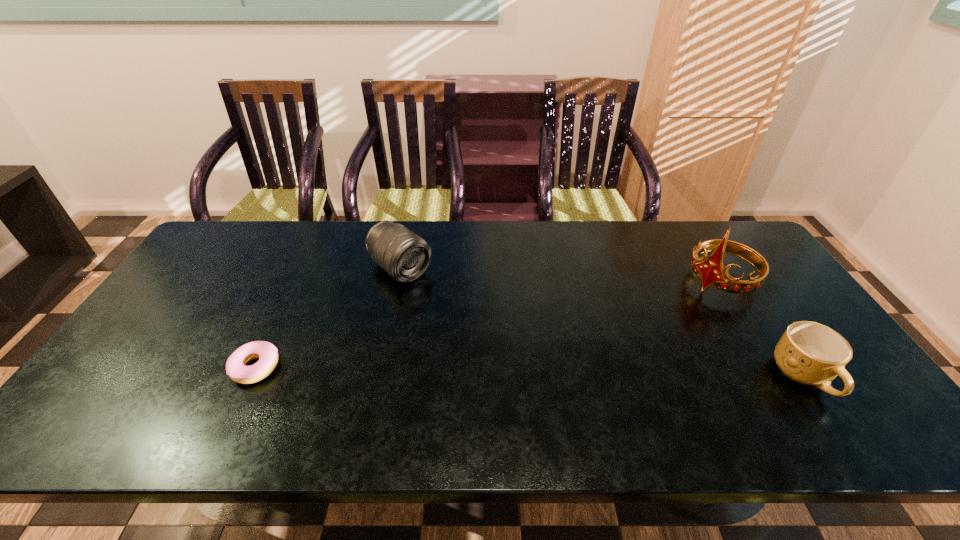
Locate an element on the screen. the leftmost object is located at coordinates (267, 353).

This screenshot has height=540, width=960. In order to click on doughnut in this screenshot , I will do `click(267, 353)`.

This screenshot has height=540, width=960. I want to click on mug, so click(x=810, y=353).

I want to click on tiara, so click(710, 271).

Where is `the second tallest object`? Image resolution: width=960 pixels, height=540 pixels. the second tallest object is located at coordinates (405, 256).

Where is `telephoto lens`? telephoto lens is located at coordinates (405, 256).

This screenshot has height=540, width=960. What are the coordinates of `free region located 0.240m on the right of the leftmost object` in the screenshot? It's located at (375, 367).

Identify the location of free space located on the front-facing side of the tiara. (641, 333).

Find the location of a particular element. free space located on the front-facing side of the tiara is located at coordinates (647, 330).

This screenshot has height=540, width=960. What are the coordinates of `vacant space positioned on the front-facing side of the tiara` in the screenshot? It's located at (677, 310).